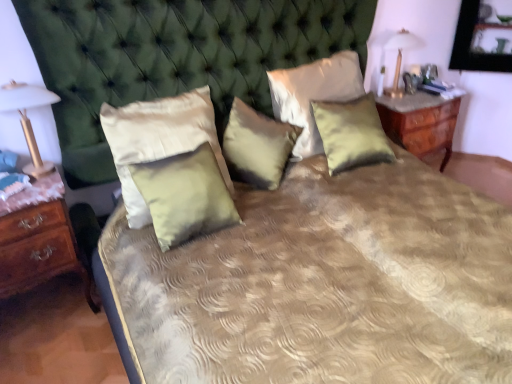
Question: Is point (373, 148) positioned closer to the camera than point (384, 89)?

Choices:
 (A) farther
 (B) closer

Answer: (B)

Question: Would you say satin yellow pillow at center, which appears as the 5th pillow when viewed from the left, is inside or outside gold metallic lampshade at upper right, the 2th bedside lamp in the left-to-right sequence?

Choices:
 (A) outside
 (B) inside

Answer: (A)

Question: Which is nearer to the satin green pillow at center, acting as the 4th pillow starting from the right?

Choices:
 (A) satin green pillow at center, which is the 3th pillow in right-to-left order
 (B) satin green pillow at center, placed as the 4th pillow when sorted from left to right
 (C) brown wood nightstand at left, which is the first nightstand in left-to-right order
 (D) wooden nightstand at right, marked as the 1th nightstand in a top-to-bottom arrangement
 (E) satin/velvet pillow at center, the 1th pillow when ordered from left to right

Answer: (E)

Question: Estimate the real-world distances between objects in this image. Which object is closer to the satin/velvet pillow at center, the 1th pillow when ordered from left to right?

Choices:
 (A) brown wood nightstand at left, the 2th nightstand when ordered from back to front
 (B) satin green pillow at center, which is counted as the second pillow, starting from the right
 (C) wooden nightstand at right, arranged as the second nightstand when ordered from the bottom
 (D) satin green pillow at center, which appears as the third pillow when viewed from the left
 (E) satin green pillow at center, acting as the 4th pillow starting from the right

Answer: (E)